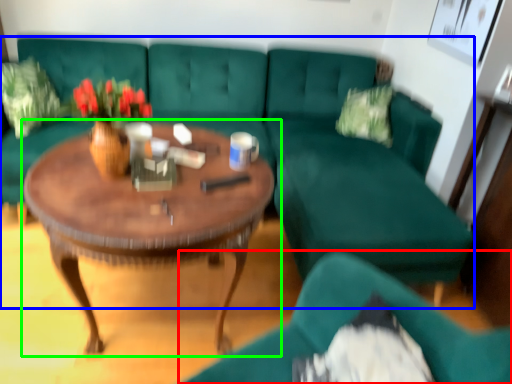
Question: Based on their relative distances, which object is farther from chair (highlighted by a red box)? Choose from studio couch (highlighted by a blue box) and coffee table (highlighted by a green box).

Choices:
 (A) studio couch
 (B) coffee table

Answer: (A)